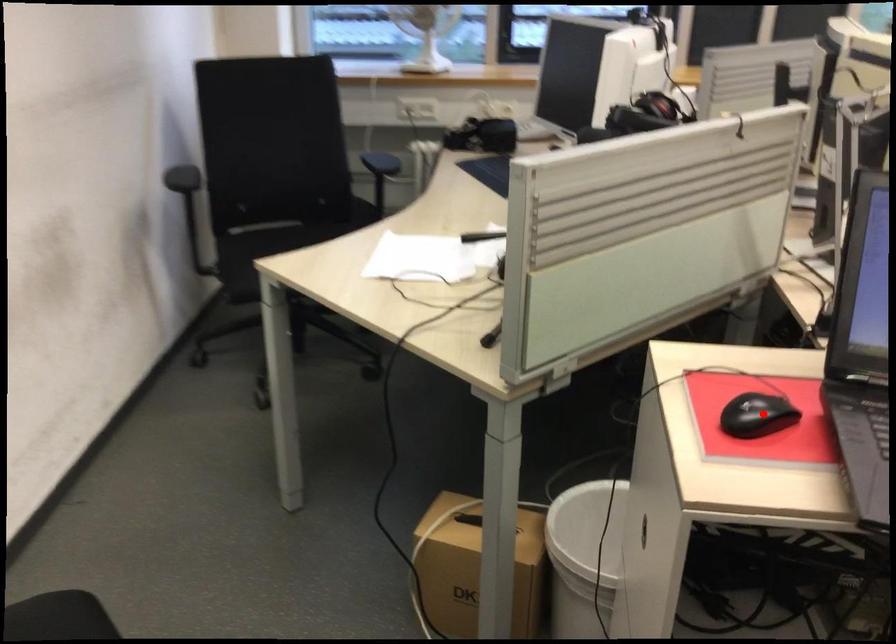
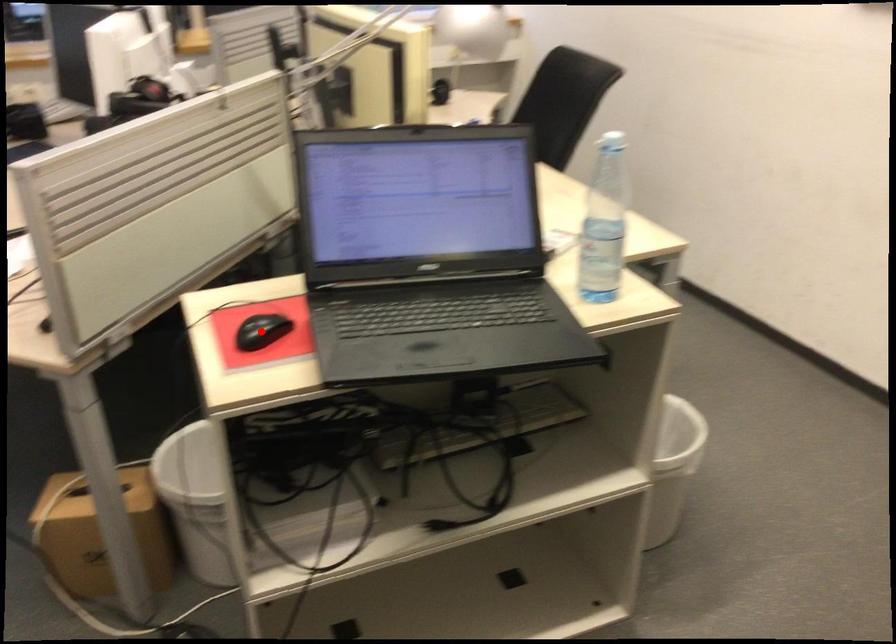
I am providing you with two images of the same scene from different viewpoints. A red point is marked on the first image and another point is marked on the second image. Is the red point in image1 aligned with the point shown in image2?

Yes